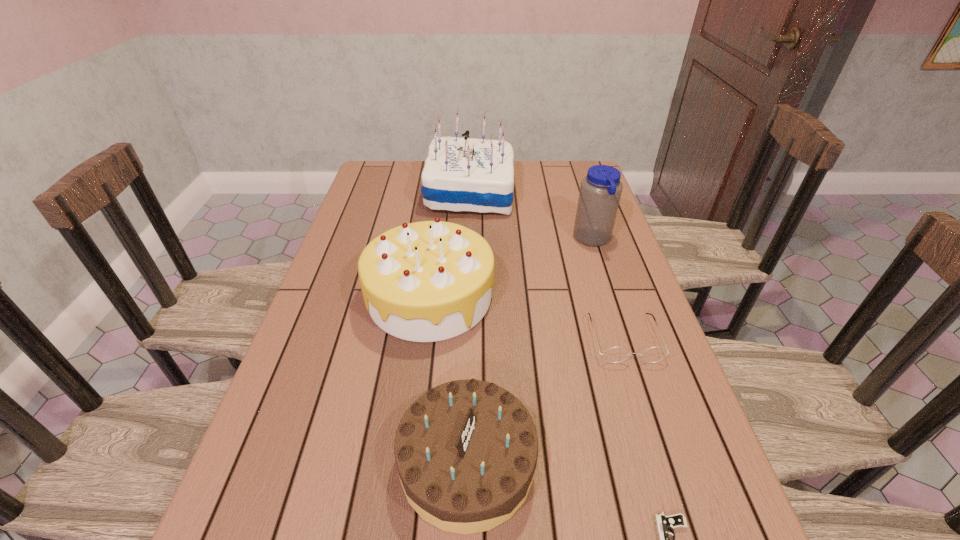
I want to click on free spot located with a carrying loop on the side of the second farthest object, so pos(488,240).

Locate an element on the screen. Image resolution: width=960 pixels, height=540 pixels. free space located 0.060m on the right of the second nearest birthday cake is located at coordinates (516, 296).

I want to click on free space located 0.230m on the front-facing side of the third shortest object, so click(660, 463).

Find the location of a particular element. This screenshot has width=960, height=540. free spot located 0.070m on the front-facing side of the spectacles is located at coordinates (641, 392).

You are a GUI agent. You are given a task and a screenshot of the screen. Output one action in this format:
    pyautogui.click(x=<x>, y=<y>)
    Task: Click on the object located at the far edge
    The image size is (960, 540).
    Given the screenshot: What is the action you would take?
    pyautogui.click(x=460, y=174)

Identify the location of object that is at the left edge. The height and width of the screenshot is (540, 960). (427, 281).

Find the location of a particular element. water bottle positioned at the right edge is located at coordinates (600, 191).

Find the location of a particular element. The width and height of the screenshot is (960, 540). spectacles that is positioned at the right edge is located at coordinates (615, 354).

Locate an element on the screen. The width and height of the screenshot is (960, 540). vacant region at the far edge of the desktop is located at coordinates (423, 168).

The height and width of the screenshot is (540, 960). Find the location of `free space at the left edge of the desktop`. free space at the left edge of the desktop is located at coordinates (368, 234).